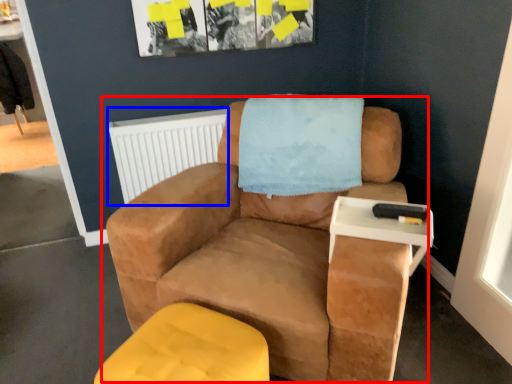
Question: Which object is further to the camera taking this photo, chair (highlighted by a red box) or radiator (highlighted by a blue box)?

Choices:
 (A) chair
 (B) radiator

Answer: (B)